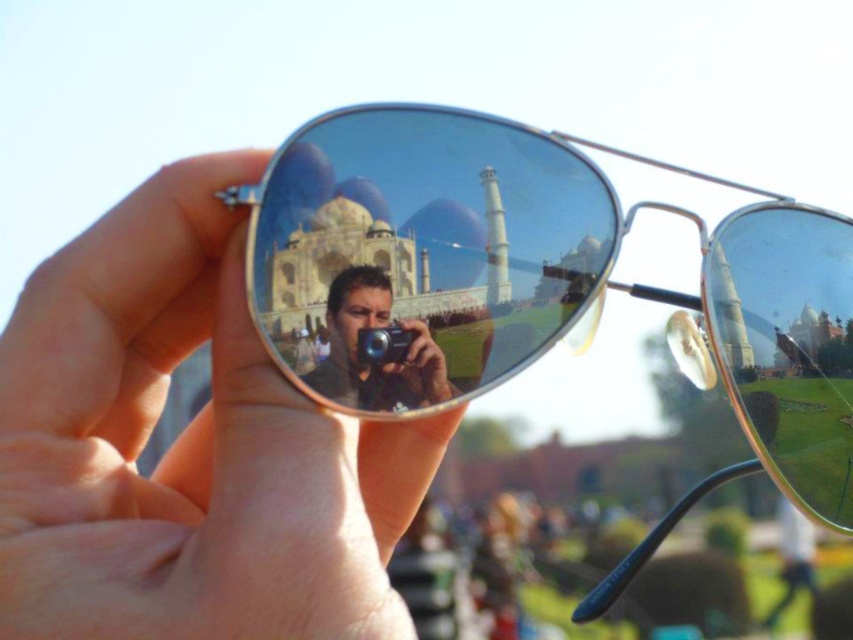
Question: Which point is farther to the camera?

Choices:
 (A) gold reflective sunglasses at center
 (B) matte black camera at center
 (C) smooth skin hand at center

Answer: (B)

Question: Can you confirm if smooth skin hand at center is thinner than matte black camera at center?

Choices:
 (A) no
 (B) yes

Answer: (A)

Question: Which object appears farthest from the camera in this image?

Choices:
 (A) matte black camera at center
 (B) smooth skin hand at center
 (C) gold reflective sunglasses at center

Answer: (A)

Question: Does gold reflective sunglasses at center lie in front of matte black camera at center?

Choices:
 (A) yes
 (B) no

Answer: (A)

Question: Is smooth skin hand at center behind matte black camera at center?

Choices:
 (A) yes
 (B) no

Answer: (B)

Question: Which object is positioned closest to the smooth skin hand at center?

Choices:
 (A) gold reflective sunglasses at center
 (B) matte black camera at center

Answer: (B)